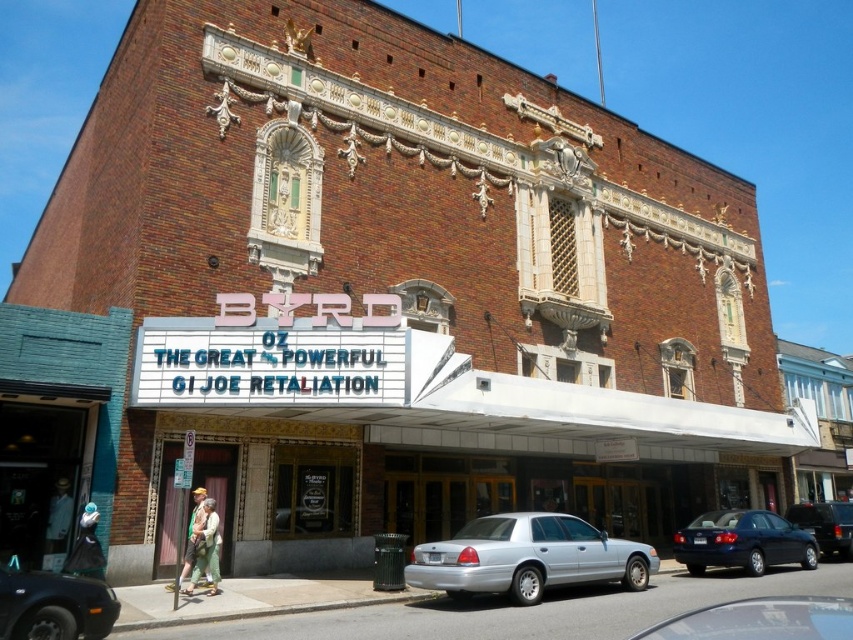
Is black rubber car at lower left above black glossy sedan at center?

Indeed, black rubber car at lower left is positioned over black glossy sedan at center.

Is point (38, 592) closer to viewer compared to point (834, 531)?

That is True.

Locate an element on the screen. This screenshot has width=853, height=640. black rubber car at lower left is located at coordinates (54, 605).

What do you see at coordinates (741, 541) in the screenshot? I see `metallic blue sedan at lower right` at bounding box center [741, 541].

Is point (708, 561) less distant than point (839, 525)?

Yes.

This screenshot has width=853, height=640. I want to click on metallic blue sedan at lower right, so click(741, 541).

Can you confirm if shiny silver sedan at center is smaller than black rubber car at lower left?

Actually, shiny silver sedan at center might be larger than black rubber car at lower left.

Measure the distance between point (718,609) and camera.

The distance of point (718,609) from camera is 22.61 meters.

This screenshot has width=853, height=640. I want to click on shiny silver sedan at center, so click(x=759, y=620).